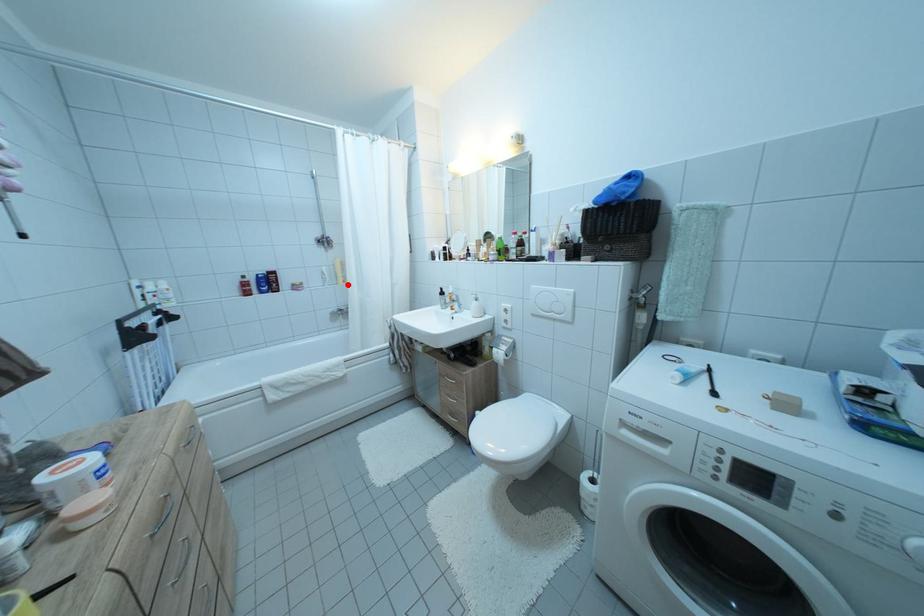
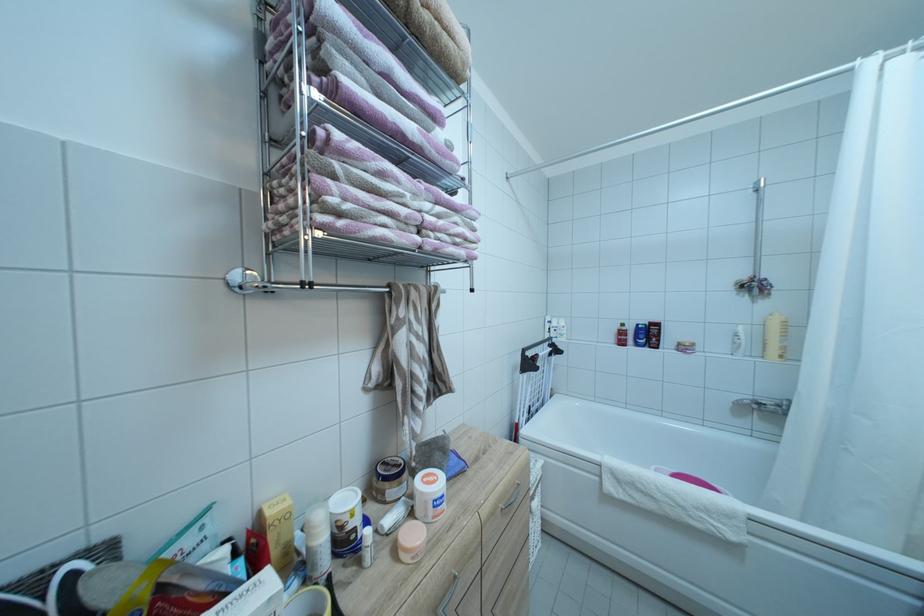
Locate, in the second image, the point that corresponds to the highlighted location in the first image.

(781, 357)